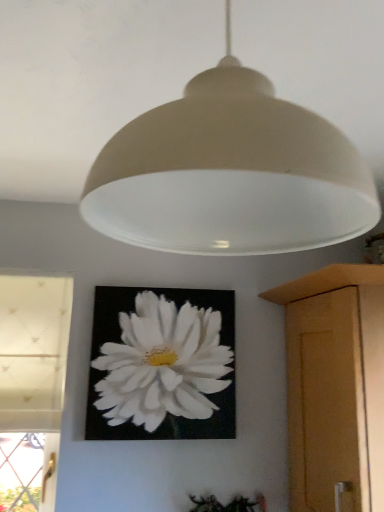
Question: Considering the relative positions of wooden cabinet at right and white textured fabric at left in the image provided, is wooden cabinet at right to the left or to the right of white textured fabric at left?

Choices:
 (A) left
 (B) right

Answer: (B)

Question: Is wooden cabinet at right in front of or behind white textured fabric at left in the image?

Choices:
 (A) front
 (B) behind

Answer: (A)

Question: Which object is the closest to the white matte flower at center?

Choices:
 (A) green matte plant at lower center
 (B) matte white lampshade at upper center
 (C) wooden cabinet at right
 (D) white textured fabric at left

Answer: (D)

Question: Considering the real-world distances, which object is farthest from the white matte flower at center?

Choices:
 (A) green matte plant at lower center
 (B) white textured fabric at left
 (C) matte white lampshade at upper center
 (D) wooden cabinet at right

Answer: (C)